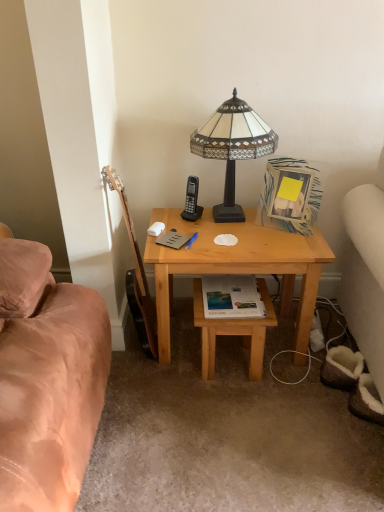
Where is `free spot above matte paper book at center, positioned as the 1th book in bottom-to-top order (from a real-world perspective)`? This screenshot has height=512, width=384. free spot above matte paper book at center, positioned as the 1th book in bottom-to-top order (from a real-world perspective) is located at coordinates (237, 292).